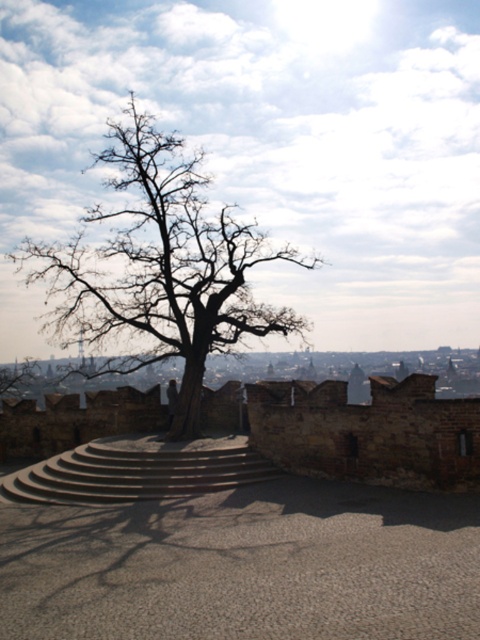
Can you confirm if bare wood tree at center is thinner than concrete stairs at center?

In fact, bare wood tree at center might be wider than concrete stairs at center.

Does bare wood tree at center have a greater width compared to concrete stairs at center?

Yes, bare wood tree at center is wider than concrete stairs at center.

Where is `bare wood tree at center`? Image resolution: width=480 pixels, height=640 pixels. bare wood tree at center is located at coordinates (159, 268).

The width and height of the screenshot is (480, 640). What are the coordinates of `bare wood tree at center` in the screenshot? It's located at (159, 268).